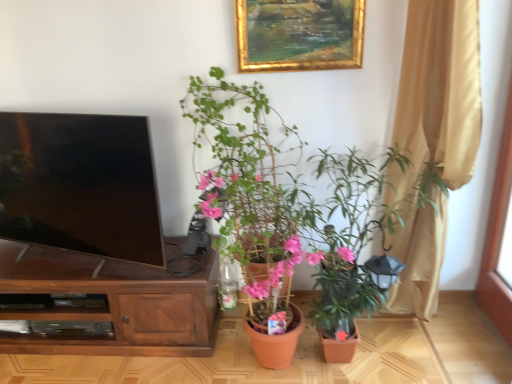
The height and width of the screenshot is (384, 512). I want to click on vacant space underneath matte black tv at left (from a real-world perspective), so click(x=74, y=260).